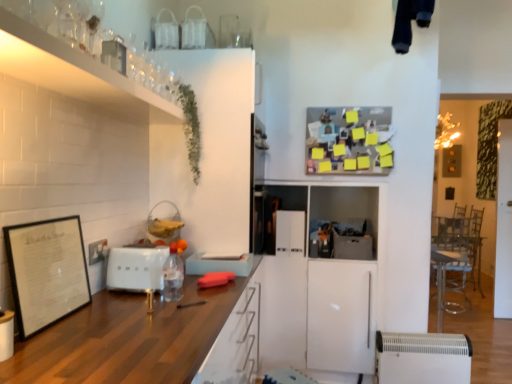
Find the location of `vacant region above white matte toaster at center, marked as the fourth appliance in a back-to-front arrangement (from a real-world perspective)`. vacant region above white matte toaster at center, marked as the fourth appliance in a back-to-front arrangement (from a real-world perspective) is located at coordinates (138, 250).